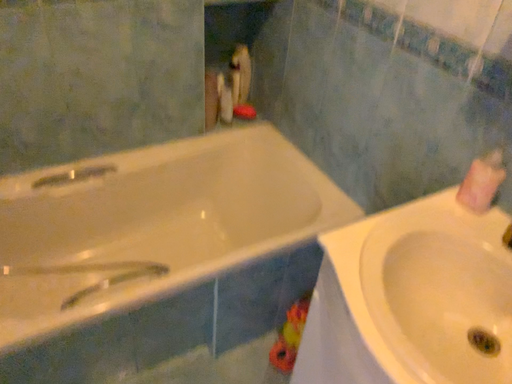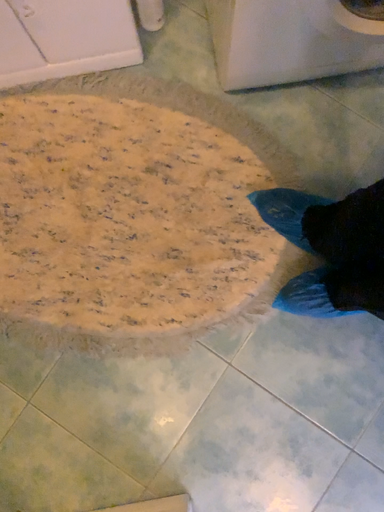
Question: How did the camera likely rotate when shooting the video?

Choices:
 (A) rotated right
 (B) rotated left

Answer: (A)